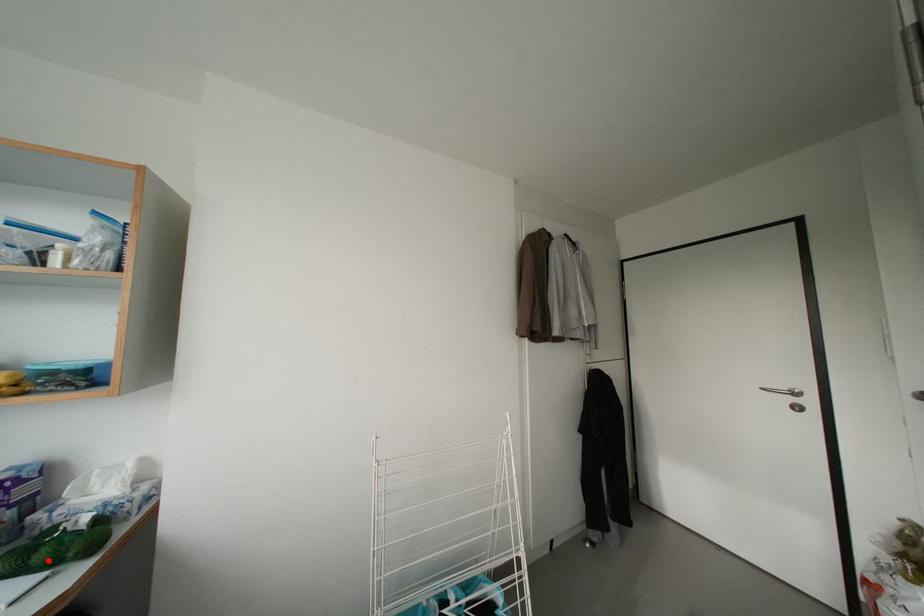
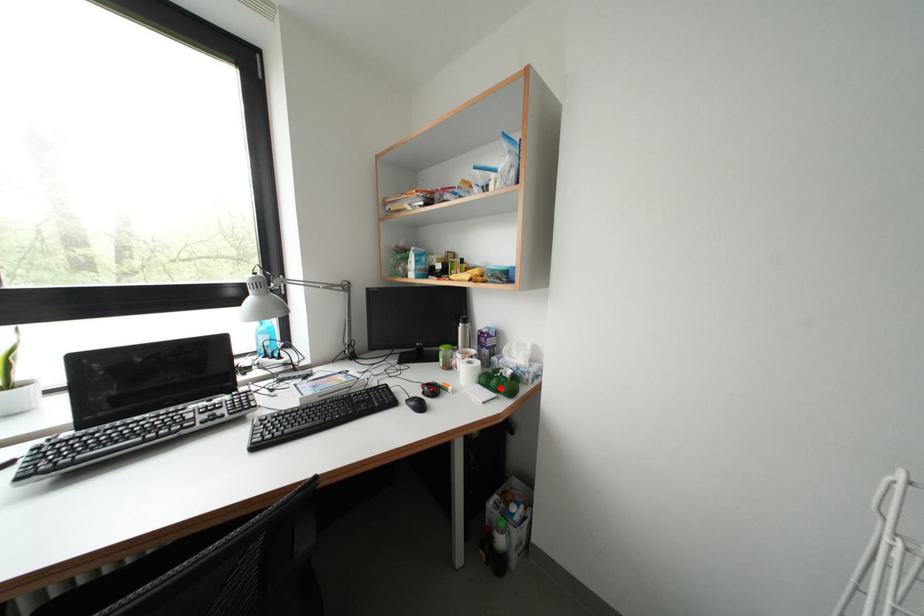
I am providing you with two images of the same scene from different viewpoints. A red point is marked on the first image and another point is marked on the second image. Does the point marked in image1 correspond to the same location as the one in image2?

Yes